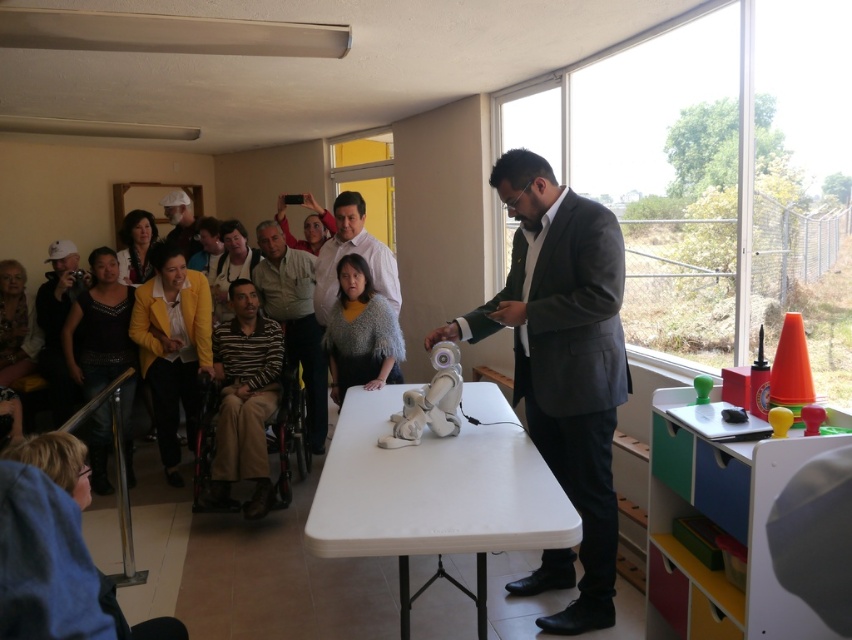
Question: In this image, where is striped fabric shirt at center located relative to matte white cap at upper left?

Choices:
 (A) left
 (B) right

Answer: (B)

Question: From the image, what is the correct spatial relationship of multicolored plastic toy storage at right in relation to striped fabric shirt at center?

Choices:
 (A) left
 (B) right

Answer: (B)

Question: Which of the following is the closest to the observer?

Choices:
 (A) striped cotton shirt at center
 (B) matte white cap at upper left
 (C) white matte robot at center

Answer: (C)

Question: Which object is farther from the camera taking this photo?

Choices:
 (A) white shirt at center
 (B) striped cotton shirt at center
 (C) matte white cap at upper left
 (D) white plastic table at center

Answer: (C)

Question: Is dark gray suit at center to the right of white shirt at center from the viewer's perspective?

Choices:
 (A) yes
 (B) no

Answer: (A)

Question: Which point is closer to the camera?

Choices:
 (A) matte white cap at upper left
 (B) white shirt at center
 (C) dark gray suit at center

Answer: (C)